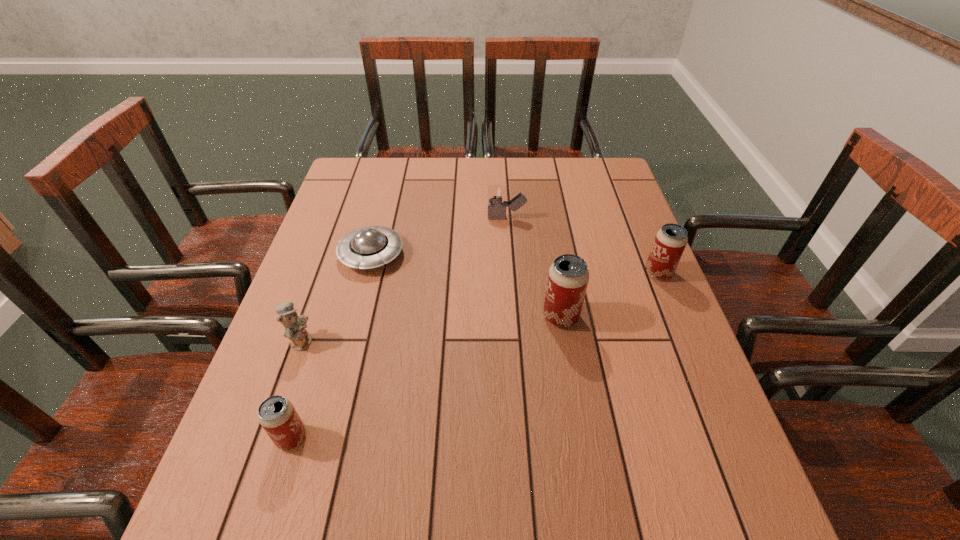
To make them evenly spaced by inserting another beer_can among them, please locate a vacant spot for this new beer_can. Please provide its 2D coordinates. Your answer should be formatted as a tuple, i.e. [(x, y)], where the tuple contains the x and y coordinates of a point satisfying the conditions above.

[(441, 370)]